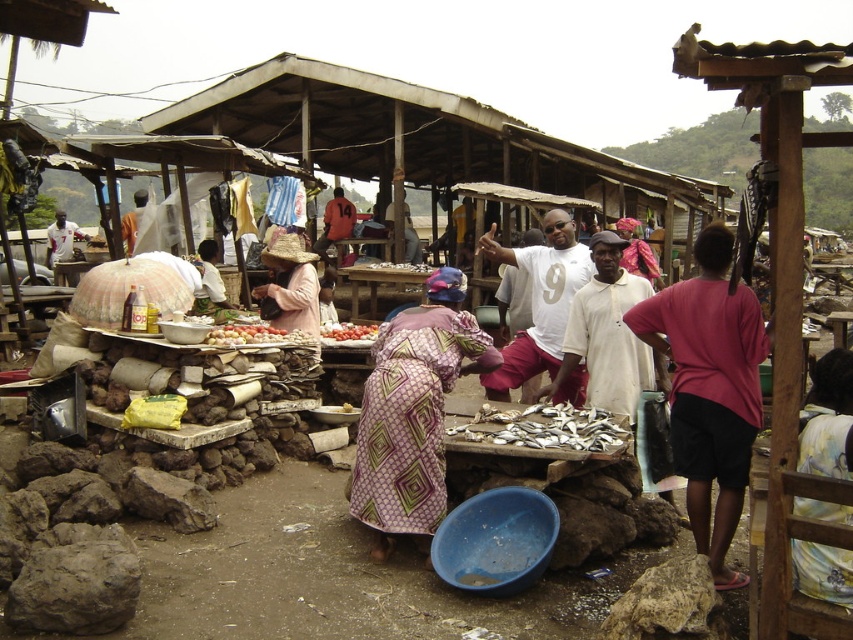
Based on the photo, you are standing at the entrance of the market and notice a pink fabric shirt at right. If you want to reach it, in which direction should you move relative to your current position?

The pink fabric shirt at right is located at point 0.608 on the x and 0.834 on the y. Since the x coordinate is 0.608, which is more than halfway across the image, you should move to the right. The y coordinate is 0.834, which is closer to the bottom of the image, so you should move downward. Therefore, you should move diagonally to the right and downward to reach the pink fabric shirt at right.

From the picture: You are standing at the entrance of the market and see two points in the scene, point (634,333) and point (492,406). Which point is closer to you?

Point (634,333) is closer to the camera than point (492,406), so it is closer to you.

You are a vendor at the market and want to place a new item between the purple printed fabric at center and the smooth red tomatoes at center. Which object should you place the item next to to ensure it fits better?

The purple printed fabric at center has a greater width than the smooth red tomatoes at center. Therefore, placing the new item next to the purple printed fabric at center would provide more space for it to fit better.